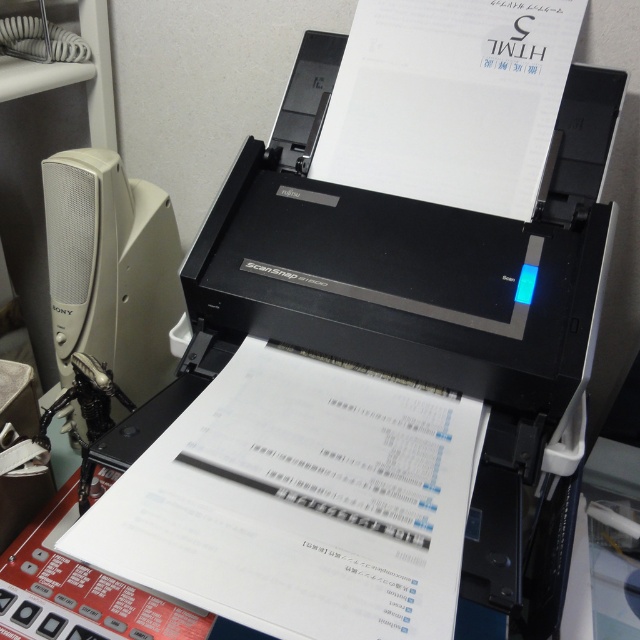
Is point (291, 508) positioned after point (496, 180)?

That is False.

Consider the image. Between white paper at center and white paper at upper center, which one appears on the left side from the viewer's perspective?

From the viewer's perspective, white paper at center appears more on the left side.

At what (x,y) coordinates should I click in order to perform the action: click on white paper at center. Please return your answer as a coordinate pair (x, y). Looking at the image, I should click on (298, 502).

Find the location of a particular element. This screenshot has height=640, width=640. white paper at center is located at coordinates (298, 502).

Looking at this image, is white paper at upper center to the left of white plastic speaker at left from the viewer's perspective?

No, white paper at upper center is not to the left of white plastic speaker at left.

In the scene shown: Measure the distance between white paper at upper center and camera.

The distance of white paper at upper center from camera is 29.34 inches.

Where is `white paper at upper center`? The height and width of the screenshot is (640, 640). white paper at upper center is located at coordinates (449, 100).

What are the coordinates of `white paper at upper center` in the screenshot? It's located at (449, 100).

Who is lower down, white paper at center or white plastic speaker at left?

white paper at center is lower down.

Does white paper at center have a greater width compared to white plastic speaker at left?

Yes.

Find the location of `white paper at center`. white paper at center is located at coordinates (298, 502).

You are a GUI agent. You are given a task and a screenshot of the screen. Output one action in this format:
    pyautogui.click(x=<x>, y=<y>)
    Task: Click on the white paper at center
    This screenshot has height=640, width=640.
    Given the screenshot: What is the action you would take?
    pyautogui.click(x=298, y=502)